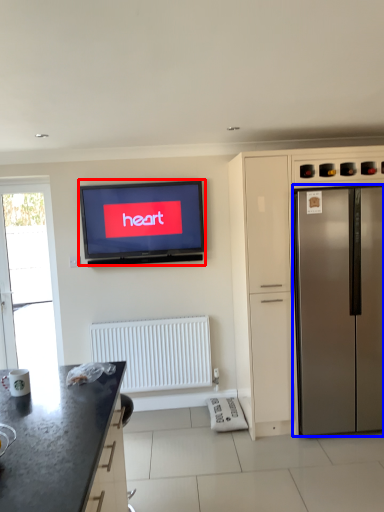
Question: Which object is closer to the camera taking this photo, television (highlighted by a red box) or refrigerator (highlighted by a blue box)?

Choices:
 (A) television
 (B) refrigerator

Answer: (B)